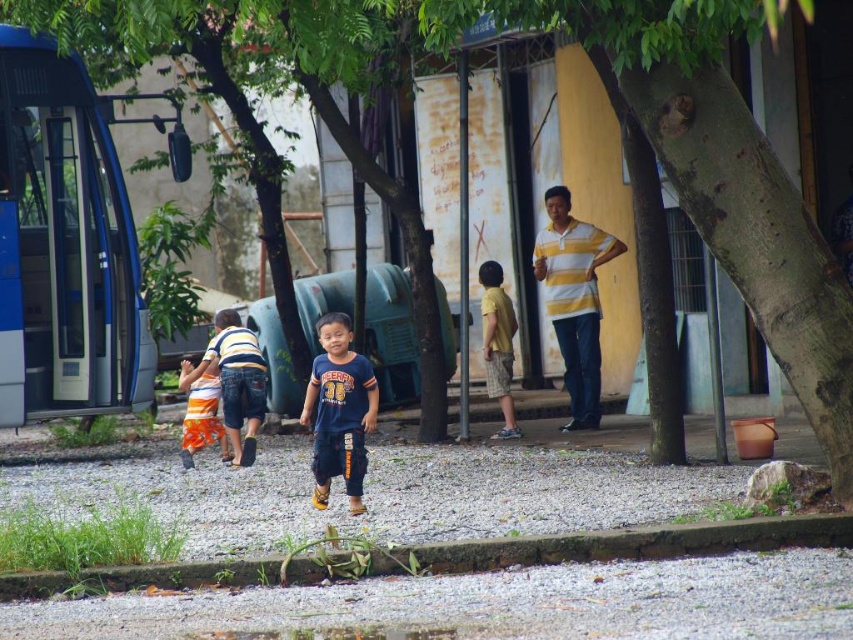
In the scene described, where exactly is the orange cotton shorts at center located in terms of coordinates?

The orange cotton shorts at center is located at the 2D coordinates point (234, 380).

You are a photographer standing at the starting point. You want to take a photo of the green leafy tree at center and the dark blue cotton shirt at center. Which object should you focus on first if you want to capture both in the same frame without moving the camera?

The green leafy tree at center is above the dark blue cotton shirt at center, so you should focus on the dark blue cotton shirt at center first to ensure both are in the frame.

You are a photographer standing at the starting point. You want to take a photo of the green leafy tree at center and the yellow cotton shirt at center. Based on their positions, which one is higher in the frame?

The green leafy tree at center is above the yellow cotton shirt at center, so it is higher in the frame.